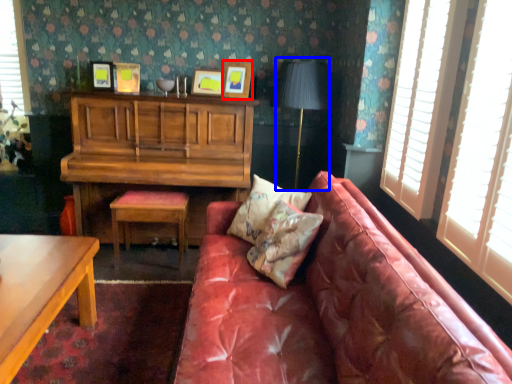
Question: Which object is closer to the camera taking this photo, picture frame (highlighted by a red box) or table lamp (highlighted by a blue box)?

Choices:
 (A) picture frame
 (B) table lamp

Answer: (B)